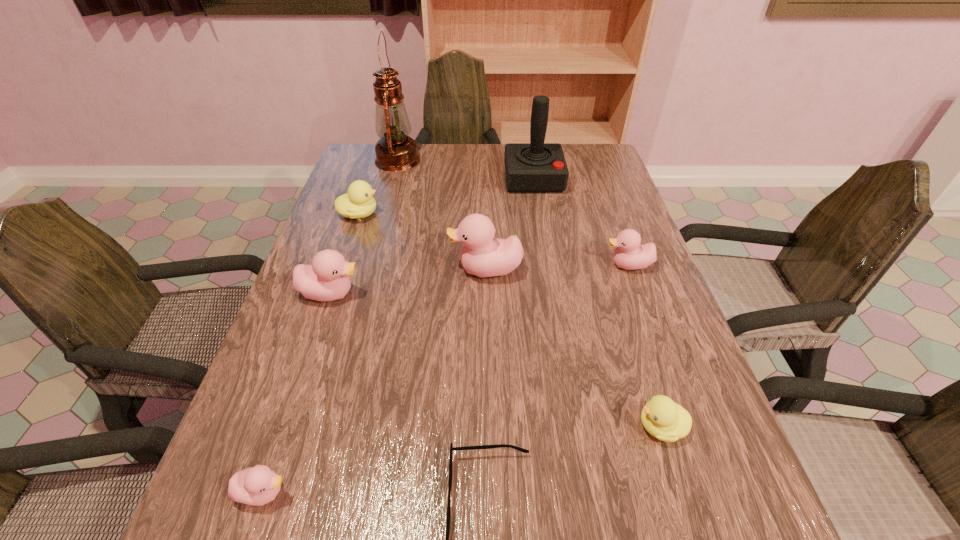
I want to click on vacant region that satisfies the following two spatial constraints: 1. on the base of the red joystick; 2. on the front-facing side of the biggest pink duckling, so click(x=548, y=269).